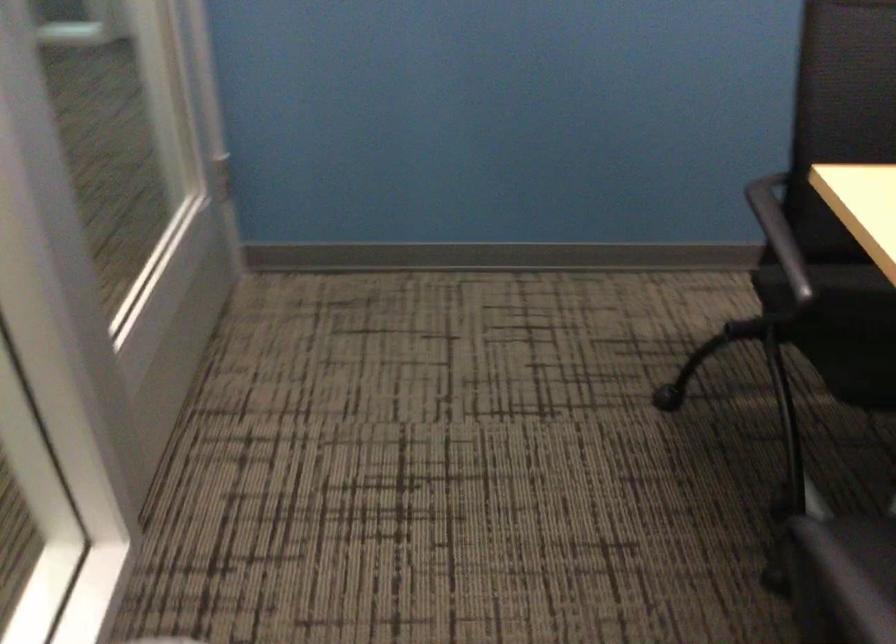
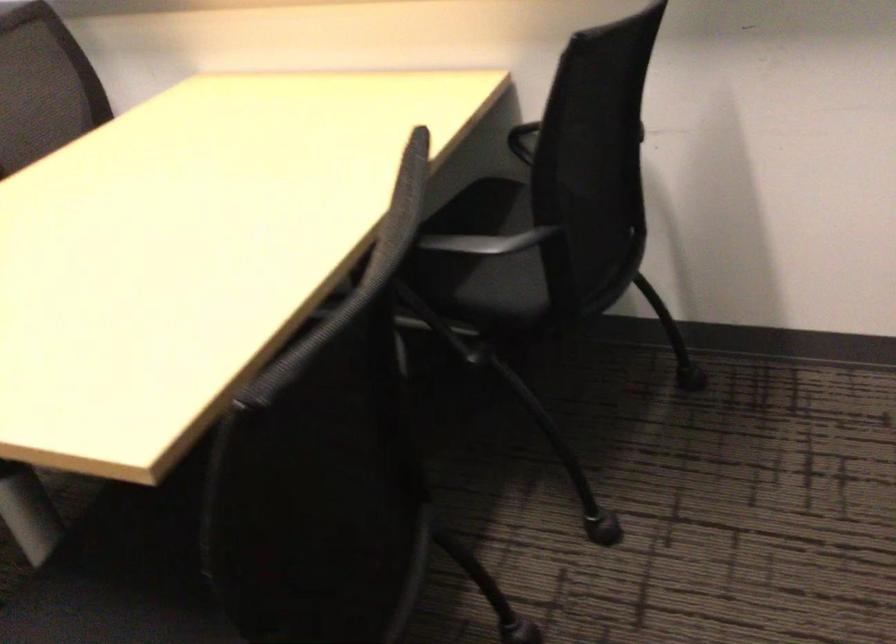
First-person continuous shooting, in which direction is the camera rotating?

The camera's rotation is toward right-down.